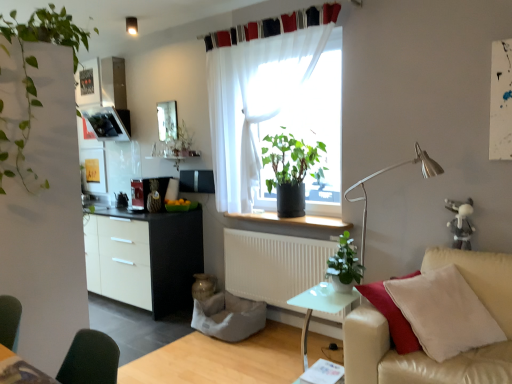
Question: Would you say metallic silver toaster at left is to the left or to the right of white metal table lamp at right in the picture?

Choices:
 (A) left
 (B) right

Answer: (A)

Question: Considering the positions of metallic silver toaster at left and white metal table lamp at right in the image, is metallic silver toaster at left taller or shorter than white metal table lamp at right?

Choices:
 (A) tall
 (B) short

Answer: (B)

Question: Which is farther from the transparent glass table at lower center?

Choices:
 (A) white sheer curtain at upper center, acting as the 1th curtain starting from the top
 (B) green matte plant at center, the 2th houseplant in the left-to-right sequence
 (C) white matte radiator at lower center
 (D) transparent glass window screen at upper center, the 2th window screen in the front-to-back sequence
 (E) white metal table lamp at right

Answer: (D)

Question: Which is nearer to the white metal table lamp at right?

Choices:
 (A) white sheer curtain at upper center, which is the 2th curtain from bottom to top
 (B) white matte radiator at lower center
 (C) green leafy plant at left, which is the 1th houseplant from left to right
 (D) transparent glass table at lower center
 (E) green matte plant at center, the 3th houseplant positioned from the front

Answer: (E)